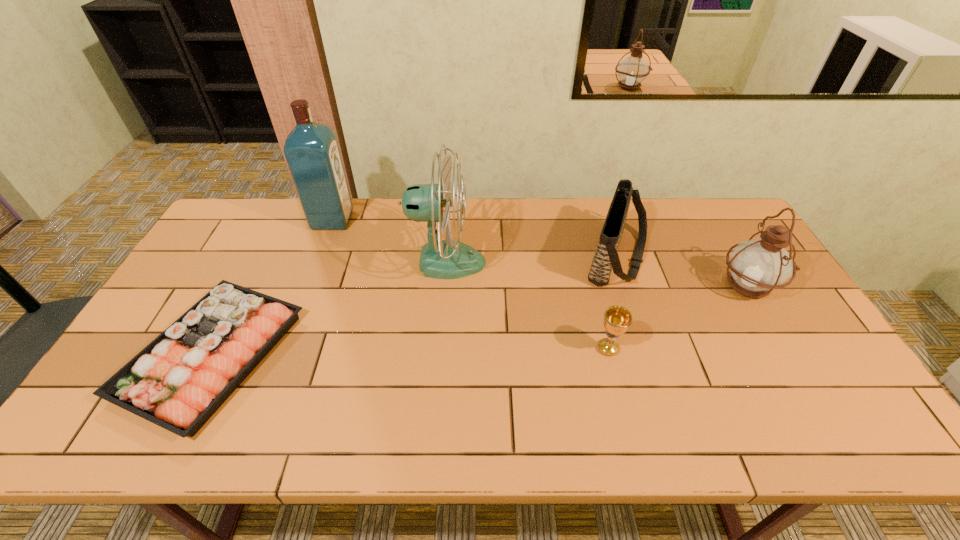
Where is `vacant space located 0.110m on the back of the handbag`? This screenshot has height=540, width=960. vacant space located 0.110m on the back of the handbag is located at coordinates (602, 207).

The width and height of the screenshot is (960, 540). In order to click on blank area located 0.190m on the right of the second shortest object in this screenshot , I will do `click(693, 348)`.

The image size is (960, 540). What are the coordinates of `vacant space located on the back of the shortest object` in the screenshot? It's located at (256, 269).

Find the location of a particular element. liquor located at the far edge is located at coordinates (311, 149).

Find the location of a particular element. fan located at the far edge is located at coordinates (441, 259).

The image size is (960, 540). Identify the location of handbag positioned at the far edge. (606, 258).

The height and width of the screenshot is (540, 960). I want to click on object that is at the near edge, so point(208,352).

Where is `object positioned at the left edge`? object positioned at the left edge is located at coordinates (208, 352).

The image size is (960, 540). I want to click on object present at the right edge, so click(x=757, y=266).

Locate an element on the screen. object that is at the near left corner is located at coordinates (208, 352).